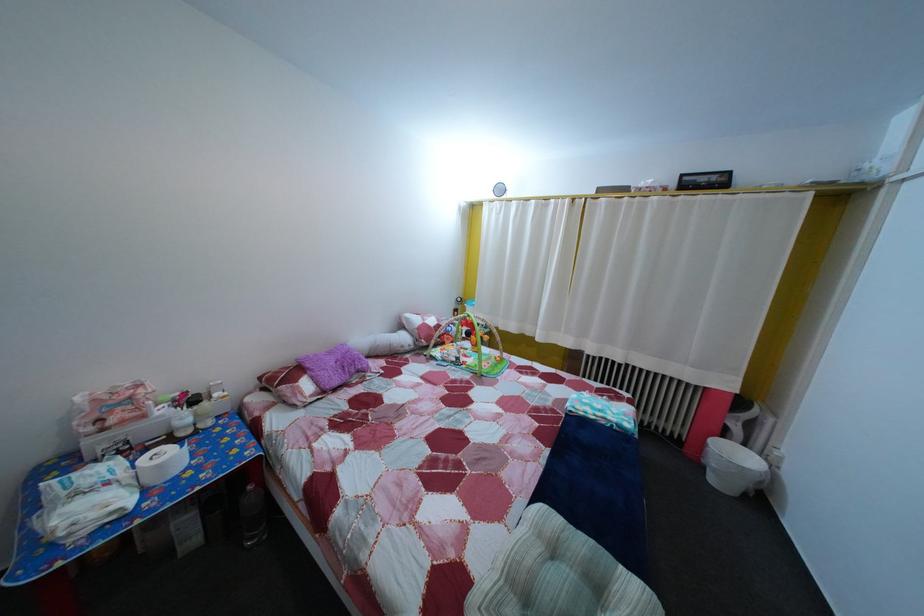
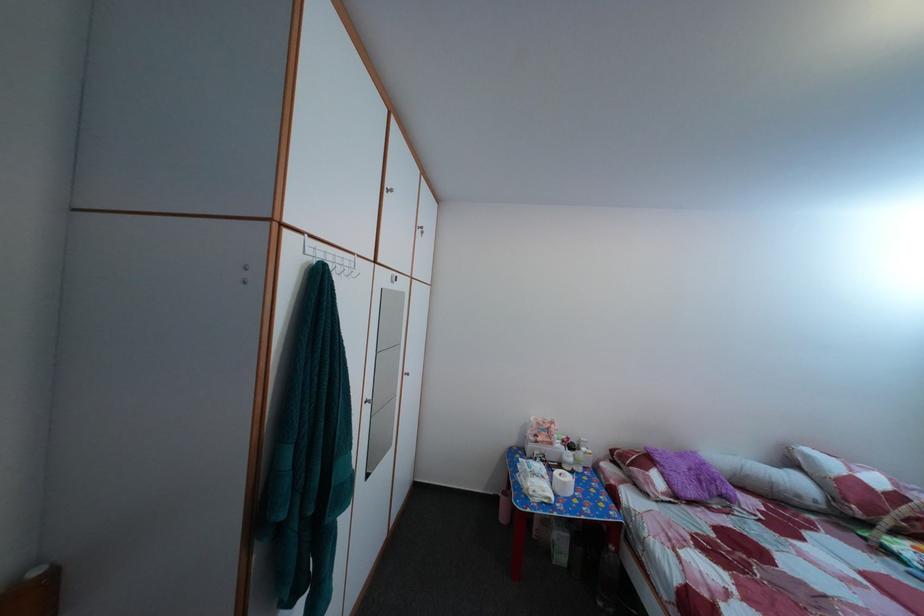
In the second image, find the point that corresponds to [140,456] in the first image.

(555, 469)